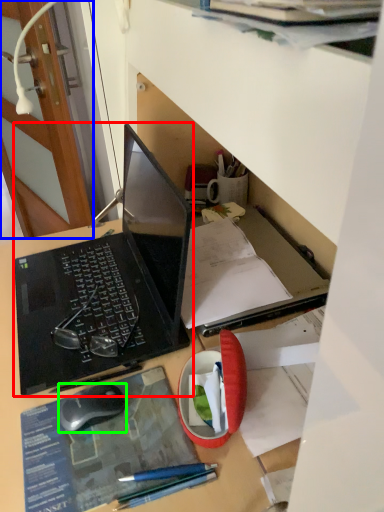
Question: Considering the real-world distances, which object is farthest from laptop (highlighted by a red box)? door (highlighted by a blue box) or computer mouse (highlighted by a green box)?

Choices:
 (A) door
 (B) computer mouse

Answer: (A)